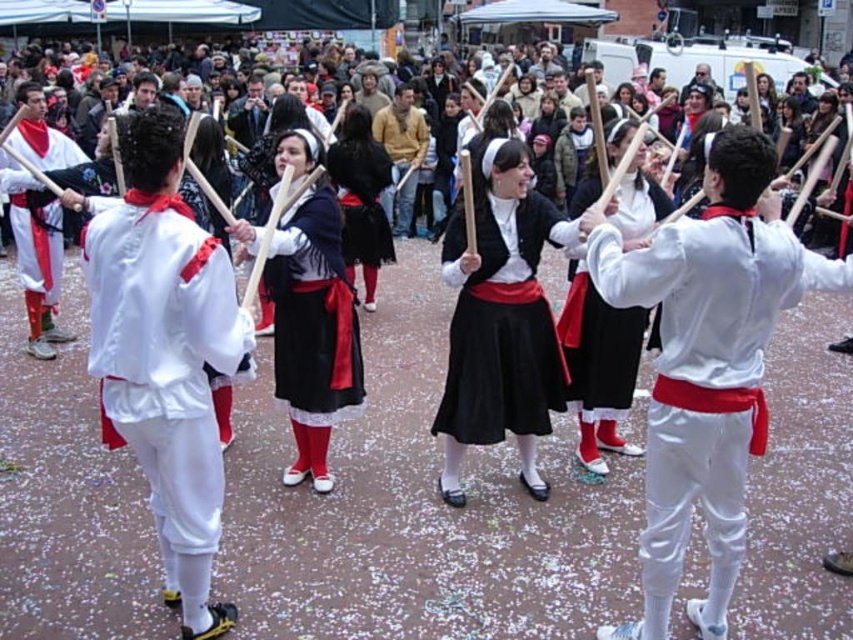
Question: Is matte black skirt at center above white matte pants at left?

Choices:
 (A) no
 (B) yes

Answer: (A)

Question: In this image, where is white cotton shirt at center located relative to matte black dress at center?

Choices:
 (A) left
 (B) right

Answer: (B)

Question: Which of the following is the farthest from the observer?

Choices:
 (A) (675, 426)
 (B) (61, 250)

Answer: (B)

Question: Which is nearer to the white cotton shirt at center?

Choices:
 (A) matte white blouse at center
 (B) matte black dress at center
 (C) matte black skirt at center

Answer: (C)

Question: Which is farther from the matte white blouse at center?

Choices:
 (A) white matte pants at left
 (B) matte black skirt at center

Answer: (A)

Question: Is matte black skirt at center positioned in front of matte black dress at center?

Choices:
 (A) no
 (B) yes

Answer: (A)